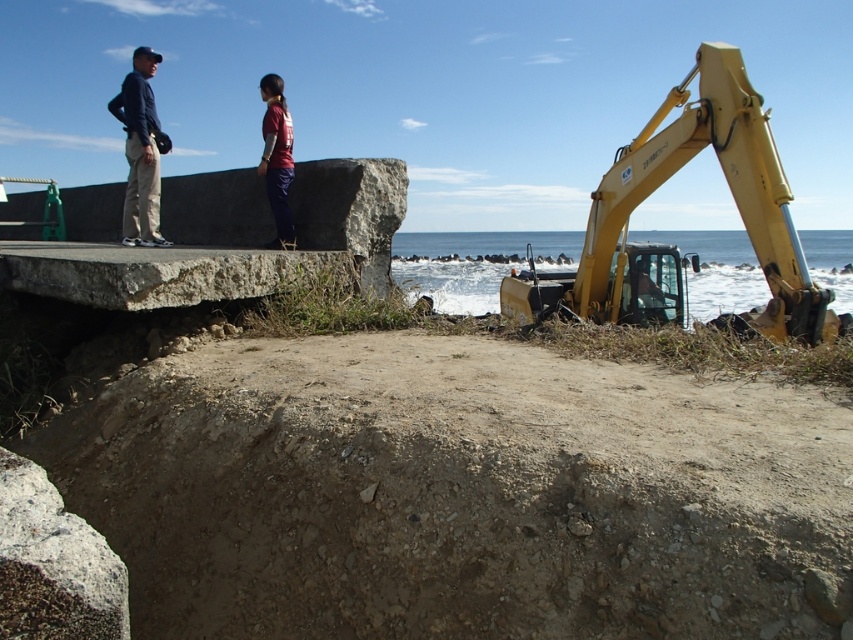
You are a construction worker who needs to move a heavy tool from the yellow metallic excavator at right to the maroon fabric pants at center. Based on their positions, which direction should you move the tool to ensure it reaches the correct location?

The yellow metallic excavator at right is below the maroon fabric pants at center, so you should move the tool upward to reach the maroon fabric pants at center from the excavator.